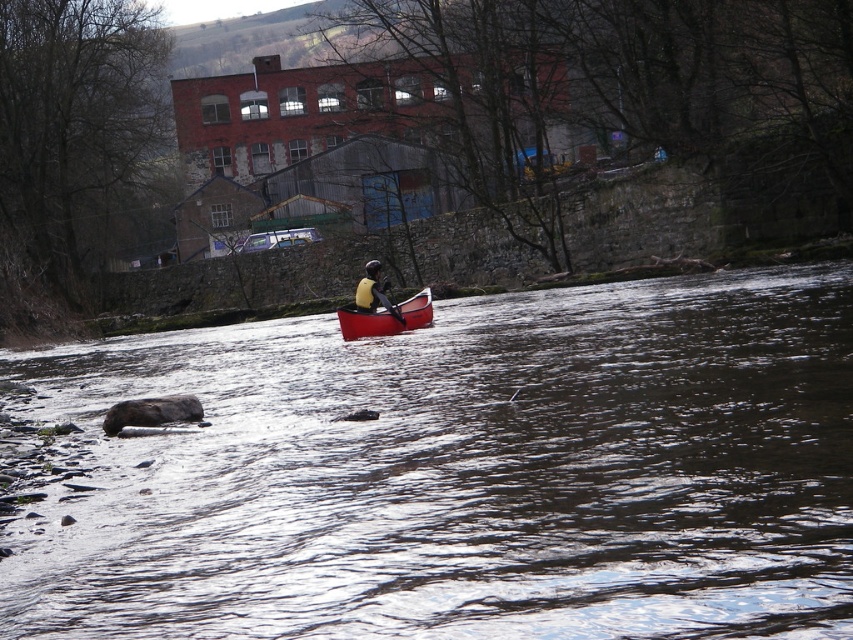
Can you confirm if smooth red canoe at center is bigger than black plastic paddle at center?

Indeed, smooth red canoe at center has a larger size compared to black plastic paddle at center.

Does smooth red canoe at center have a greater width compared to black plastic paddle at center?

Yes.

Describe the element at coordinates (387, 317) in the screenshot. I see `smooth red canoe at center` at that location.

Locate an element on the screen. The width and height of the screenshot is (853, 640). smooth red canoe at center is located at coordinates (387, 317).

Measure the distance between smooth plastic water at center and camera.

They are 6.17 meters apart.

Between point (633, 468) and point (368, 314), which one is positioned behind?

Point (368, 314)

Describe the element at coordinates (469, 472) in the screenshot. I see `smooth plastic water at center` at that location.

Locate an element on the screen. The width and height of the screenshot is (853, 640). smooth plastic water at center is located at coordinates (469, 472).

Does smooth plastic water at center lie in front of black plastic paddle at center?

Yes, smooth plastic water at center is closer to the viewer.

What do you see at coordinates (469, 472) in the screenshot? I see `smooth plastic water at center` at bounding box center [469, 472].

I want to click on smooth plastic water at center, so point(469,472).